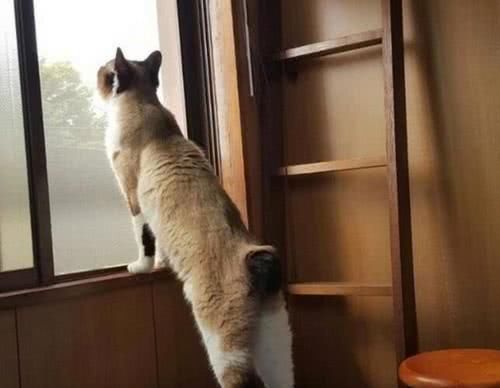
I want to click on windows, so click(x=66, y=33), click(x=7, y=42).